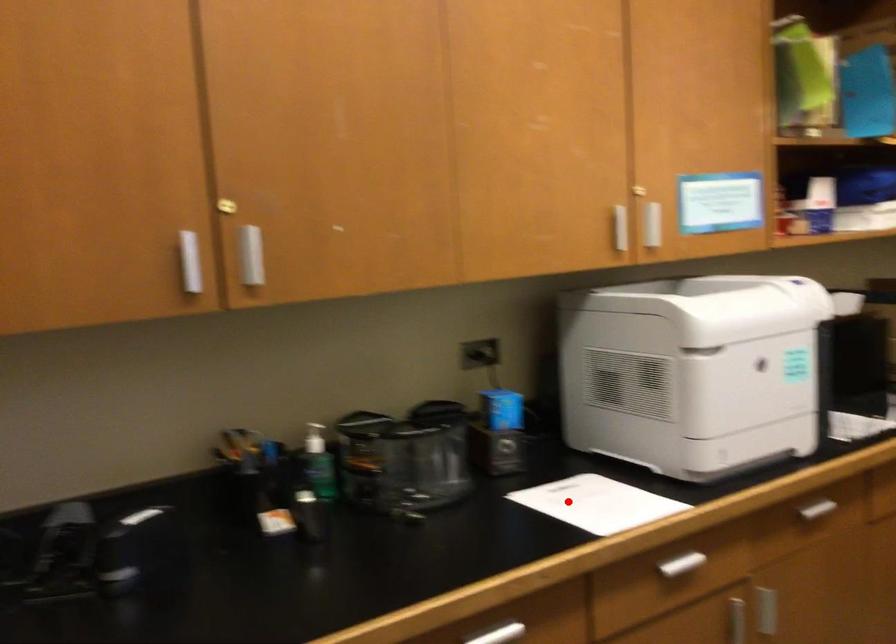
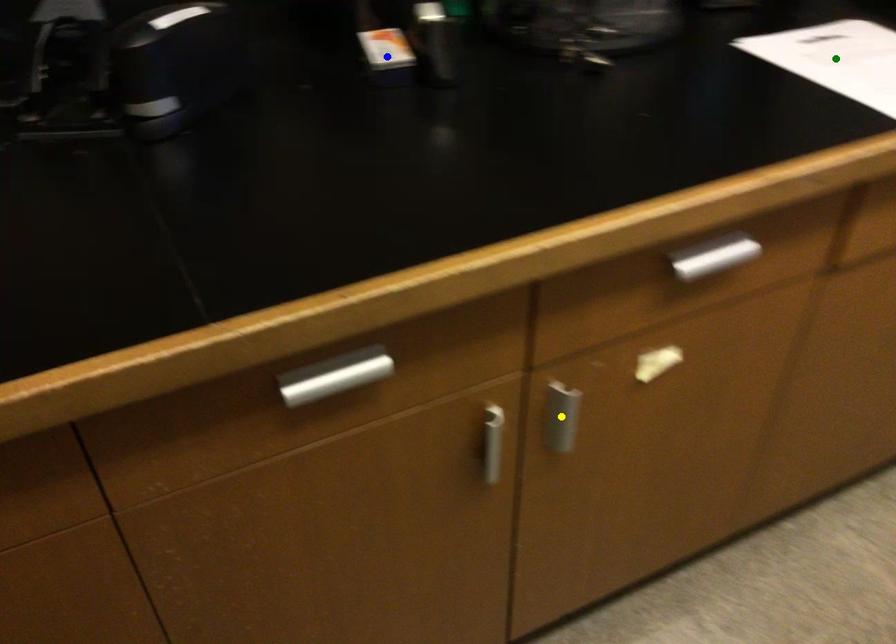
Question: I am providing you with two images of the same scene from different viewpoints. A red point is marked on the first image. You are given multiple points on the second image. Which point in image 2 represents the same 3d spot as the red point in image 1?

Choices:
 (A) green point
 (B) blue point
 (C) yellow point

Answer: (A)